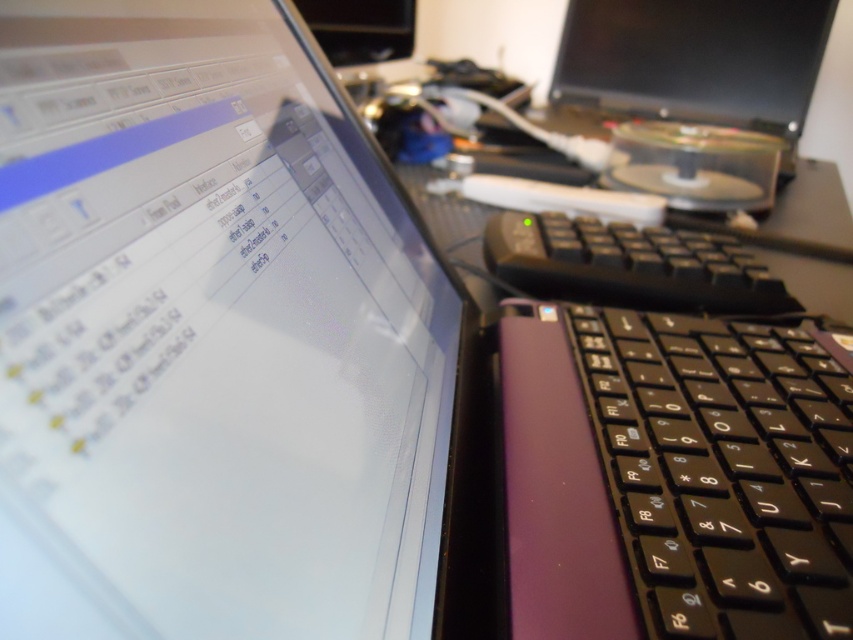
Question: Can you confirm if satin black laptop at upper left is wider than black plastic keyboard at center?

Choices:
 (A) yes
 (B) no

Answer: (B)

Question: Among these objects, which one is nearest to the camera?

Choices:
 (A) matte black monitor at upper right
 (B) matte black monitor at upper center
 (C) satin black laptop at upper left
 (D) purple matte keyboard at center

Answer: (C)

Question: Which is farther from the purple matte keyboard at center?

Choices:
 (A) black plastic keyboard at center
 (B) matte black monitor at upper center
 (C) satin black laptop at upper left
 (D) matte black monitor at upper right

Answer: (D)

Question: Is satin black laptop at upper left to the left of purple matte keyboard at center from the viewer's perspective?

Choices:
 (A) yes
 (B) no

Answer: (A)

Question: Estimate the real-world distances between objects in this image. Which object is farther from the matte black monitor at upper center?

Choices:
 (A) satin black laptop at upper left
 (B) black plastic keyboard at center

Answer: (B)

Question: Considering the relative positions of purple matte keyboard at center and black plastic keyboard at center in the image provided, where is purple matte keyboard at center located with respect to black plastic keyboard at center?

Choices:
 (A) right
 (B) left

Answer: (A)